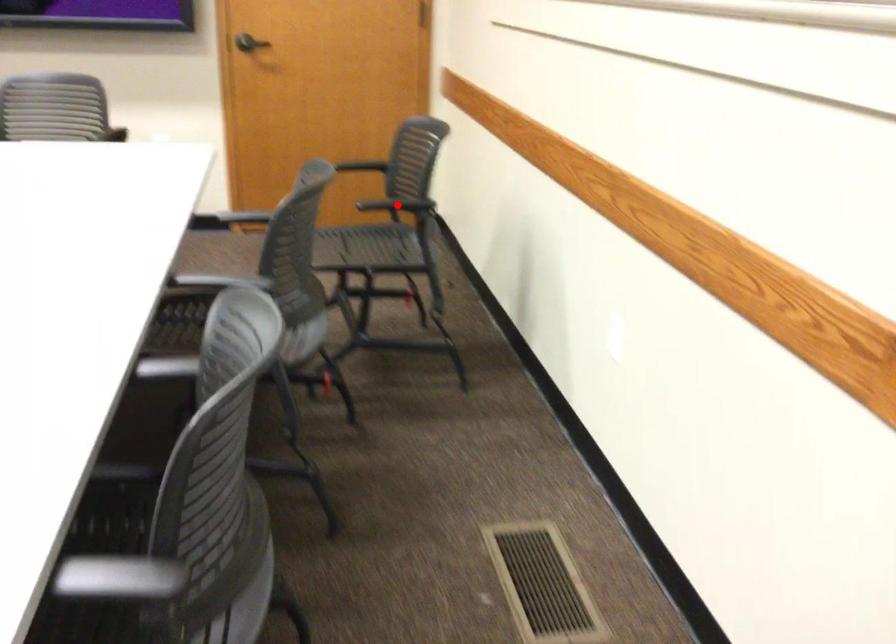
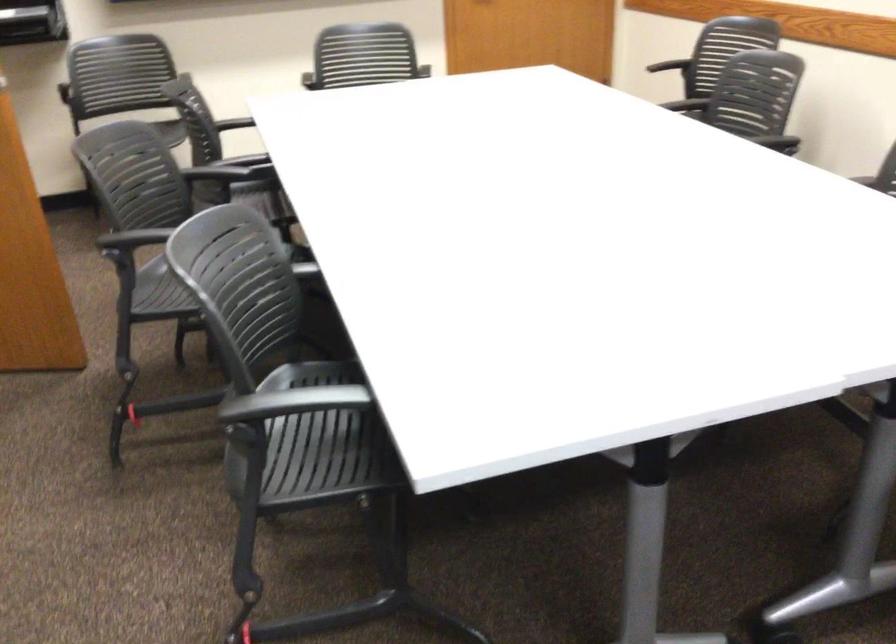
Question: I am providing you with two images of the same scene from different viewpoints. A red point is marked on the first image. Is the red point's position out of view in image 2?

Choices:
 (A) Yes
 (B) No

Answer: (A)